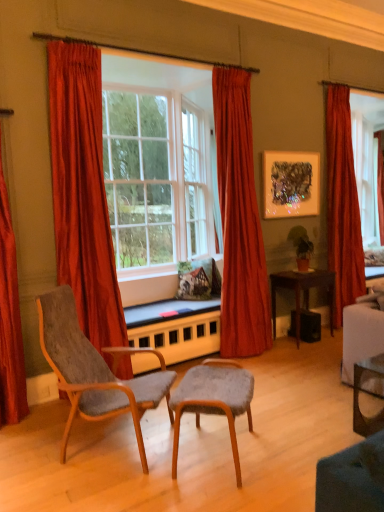
Question: Is metallic textured artwork at upper right looking in the opposite direction of clear glass desk at lower right, acting as the 1th desk starting from the front?

Choices:
 (A) yes
 (B) no

Answer: (B)

Question: From a real-world perspective, is metallic textured artwork at upper right located beneath clear glass desk at lower right, acting as the 1th desk starting from the front?

Choices:
 (A) yes
 (B) no

Answer: (B)

Question: Can you confirm if metallic textured artwork at upper right is thinner than clear glass desk at lower right, acting as the 1th desk starting from the front?

Choices:
 (A) no
 (B) yes

Answer: (B)

Question: Can you confirm if metallic textured artwork at upper right is positioned to the right of clear glass desk at lower right, the 2th desk viewed from the back?

Choices:
 (A) yes
 (B) no

Answer: (B)

Question: Does metallic textured artwork at upper right lie behind clear glass desk at lower right, acting as the 1th desk starting from the front?

Choices:
 (A) no
 (B) yes

Answer: (B)

Question: From their relative heights in the image, would you say green matte houseplant at upper right is taller or shorter than velvet red curtain at right, placed as the first curtain when sorted from right to left?

Choices:
 (A) tall
 (B) short

Answer: (B)

Question: Considering the positions of green matte houseplant at upper right and velvet red curtain at right, which ranks as the fourth curtain in left-to-right order, in the image, is green matte houseplant at upper right bigger or smaller than velvet red curtain at right, which ranks as the fourth curtain in left-to-right order,?

Choices:
 (A) big
 (B) small

Answer: (B)

Question: Is green matte houseplant at upper right situated inside velvet red curtain at right, placed as the first curtain when sorted from right to left, or outside?

Choices:
 (A) inside
 (B) outside

Answer: (B)

Question: Is point (304, 250) positioned closer to the camera than point (337, 130)?

Choices:
 (A) farther
 (B) closer

Answer: (B)

Question: Does point (271, 281) appear closer or farther from the camera than point (3, 207)?

Choices:
 (A) farther
 (B) closer

Answer: (A)

Question: From a real-world perspective, is wooden desk at lower right, the 2th desk positioned from the front, positioned above or below satin red curtain at left, the fourth curtain when ordered from right to left?

Choices:
 (A) above
 (B) below

Answer: (B)

Question: Considering the positions of wooden desk at lower right, which is the first desk in back-to-front order, and satin red curtain at left, the fourth curtain when ordered from right to left, in the image, is wooden desk at lower right, which is the first desk in back-to-front order, taller or shorter than satin red curtain at left, the fourth curtain when ordered from right to left,?

Choices:
 (A) short
 (B) tall

Answer: (A)

Question: Relative to satin red curtain at left, the fourth curtain when ordered from right to left, is wooden desk at lower right, which is the first desk in back-to-front order, in front or behind?

Choices:
 (A) behind
 (B) front

Answer: (A)

Question: Is point (228, 241) positioned closer to the camera than point (14, 281)?

Choices:
 (A) closer
 (B) farther

Answer: (B)

Question: From the image's perspective, is velvet red curtain at center, placed as the second curtain when sorted from right to left, positioned above or below satin red curtain at left, the fourth curtain when ordered from right to left?

Choices:
 (A) below
 (B) above

Answer: (B)